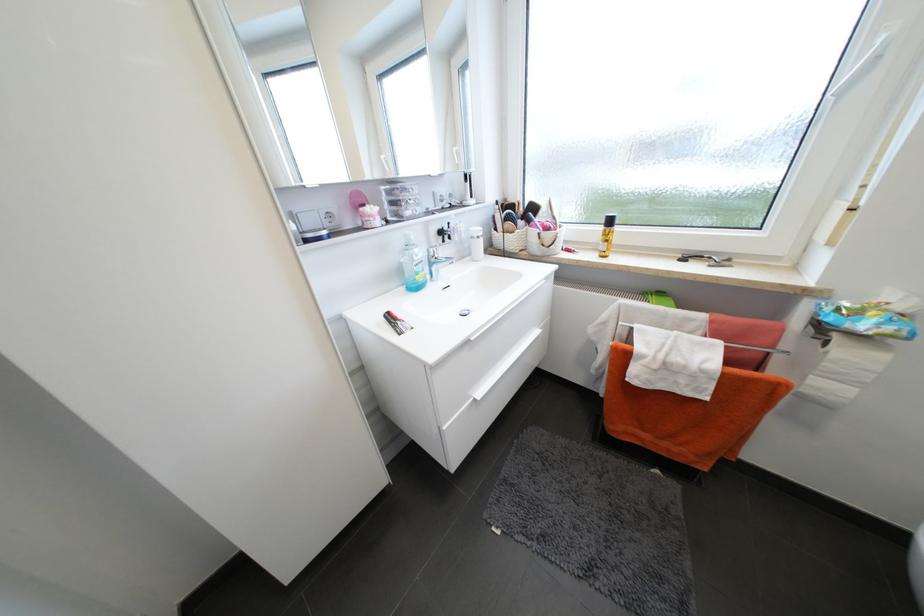
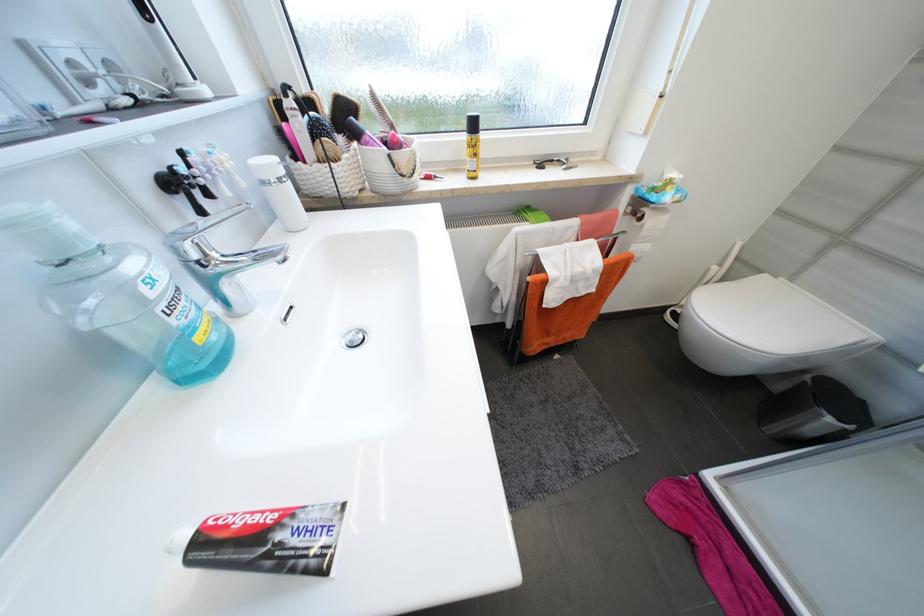
Where in the second image is the point corresponding to point (708, 257) from the first image?

(558, 161)